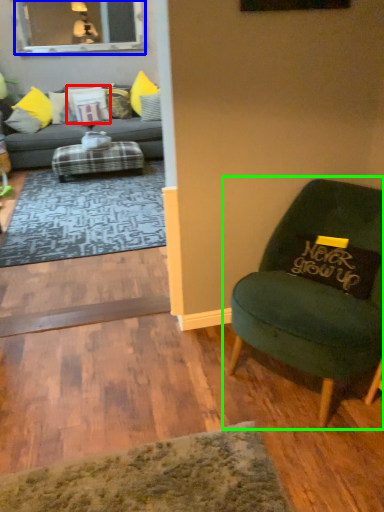
Question: Estimate the real-world distances between objects in this image. Which object is farther from pillow (highlighted by a red box), glass door (highlighted by a blue box) or chair (highlighted by a green box)?

Choices:
 (A) glass door
 (B) chair

Answer: (B)